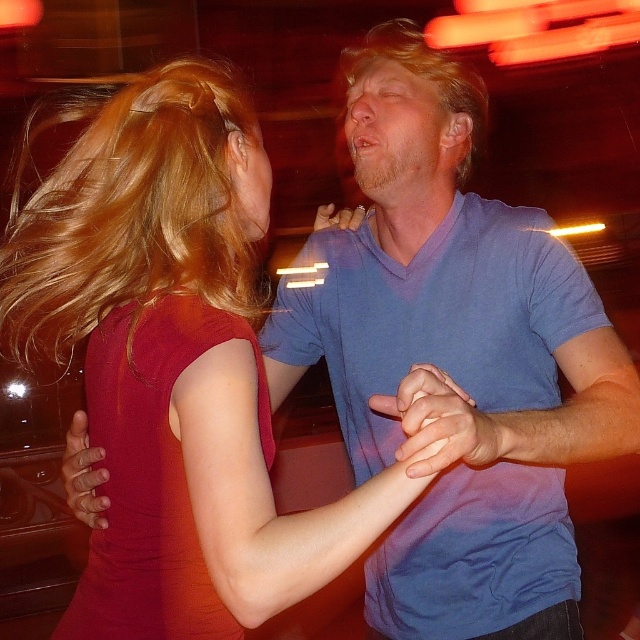
Between blondehair at upper left and blondehair at center, which one is positioned lower?

blondehair at upper left

Does blondehair at upper left have a greater width compared to blondehair at center?

Indeed, blondehair at upper left has a greater width compared to blondehair at center.

Is point (195, 204) positioned before point (445, 65)?

Yes, it is.

Where is `blondehair at upper left`? This screenshot has width=640, height=640. blondehair at upper left is located at coordinates (131, 212).

Does matte red dress at center have a smaller size compared to matte skin hand at center?

No, matte red dress at center is not smaller than matte skin hand at center.

Looking at this image, is matte red dress at center taller than matte skin hand at center?

Correct, matte red dress at center is much taller as matte skin hand at center.

Is point (248, 348) farther from camera compared to point (88, 444)?

No, it is in front of (88, 444).

Where is `matte red dress at center`? The width and height of the screenshot is (640, 640). matte red dress at center is located at coordinates (176, 364).

Does matte red dress at center have a lesser height compared to blondehair at upper left?

Incorrect, matte red dress at center's height does not fall short of blondehair at upper left's.

Is matte red dress at center thinner than blondehair at upper left?

Yes, matte red dress at center is thinner than blondehair at upper left.

Is point (189, 497) less distant than point (192, 268)?

Yes, point (189, 497) is closer to viewer.

The height and width of the screenshot is (640, 640). Identify the location of matte red dress at center. click(x=176, y=364).